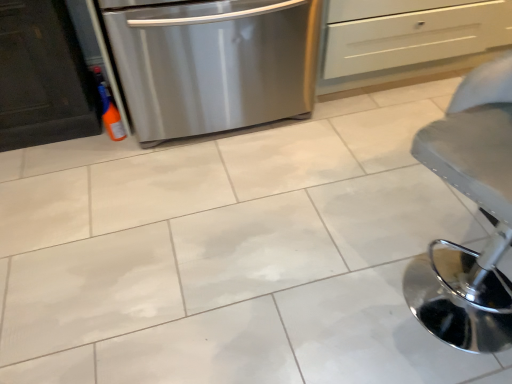
Image resolution: width=512 pixels, height=384 pixels. What are the coordinates of `vacant space to the right of stainless steel dishwasher at left` in the screenshot? It's located at (367, 130).